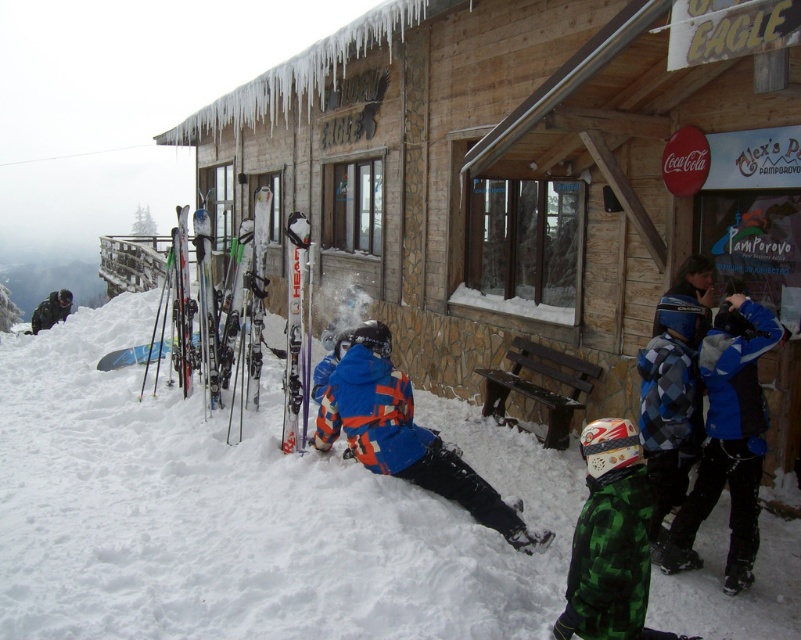
Question: Is green metallic ski at center in front of matte black skis at left?

Choices:
 (A) yes
 (B) no

Answer: (A)

Question: From the image, what is the correct spatial relationship of green camouflage jacket at lower right in relation to blue checkered jacket at lower right?

Choices:
 (A) above
 (B) below

Answer: (B)

Question: Among these objects, which one is farthest from the camera?

Choices:
 (A) green metallic ski at center
 (B) blue checkered jacket at lower right

Answer: (A)

Question: Is white fluffy snow at lower left below green metallic ski at center?

Choices:
 (A) no
 (B) yes

Answer: (B)

Question: Among these objects, which one is farthest from the camera?

Choices:
 (A) blue plaid snowboard at center
 (B) matte black skis at left
 (C) blue checkered jacket at lower right
 (D) blue checkered jacket at center right

Answer: (B)

Question: Which point is closer to the camera?

Choices:
 (A) blue plaid snowboard at center
 (B) blue checkered jacket at lower right
 (C) white fluffy snow at lower left
 (D) blue checkered jacket at center right

Answer: (C)